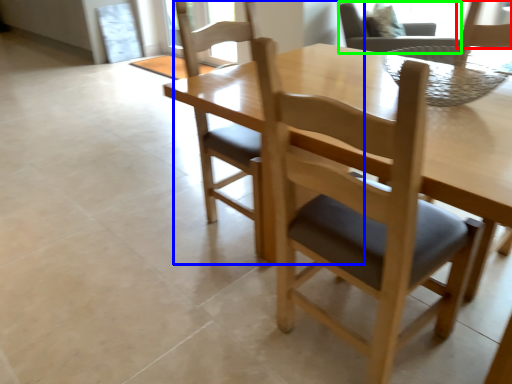
Question: Estimate the real-world distances between objects in this image. Which object is farther from chair (highlighted by a red box), chair (highlighted by a blue box) or chair (highlighted by a green box)?

Choices:
 (A) chair
 (B) chair

Answer: (B)